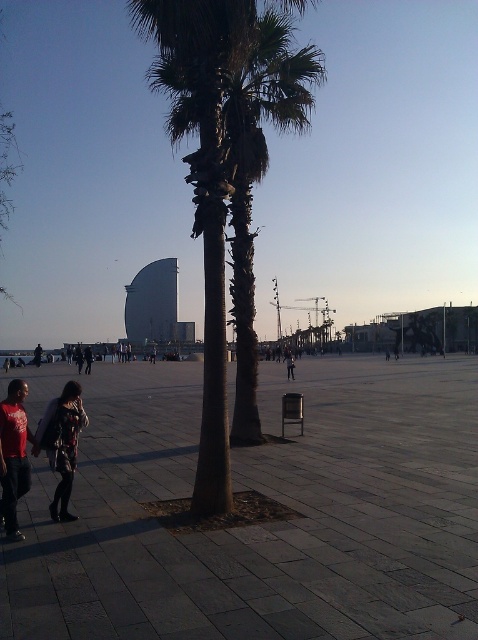
You are a delivery person trying to place a small package between the dark gray fabric coat at lower left and the red cotton shirt at lower left. Based on their widths, will there be enough space for the package?

The dark gray fabric coat at lower left has a lesser width compared to red cotton shirt at lower left. Since the coat is narrower, there might be sufficient space between them for the package, but the exact width of the package is needed to determine if it fits.

You are a delivery person who needs to place a package on the widest surface available between the dark stone plaza at center and the dark gray fabric coat at lower left. Which surface should you choose based on their widths?

The dark stone plaza at center has a greater width than the dark gray fabric coat at lower left, so you should place the package on the dark stone plaza at center.